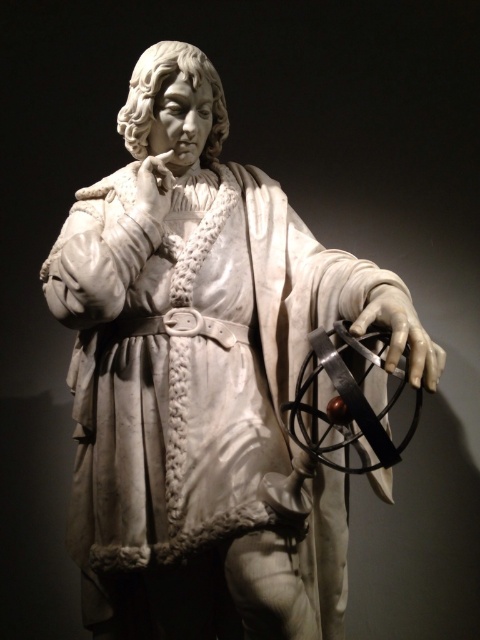
Between white marble sphere at center and white marble hand at center, which one appears on the left side from the viewer's perspective?

white marble hand at center is more to the left.

Find the location of a particular element. The image size is (480, 640). white marble sphere at center is located at coordinates (402, 333).